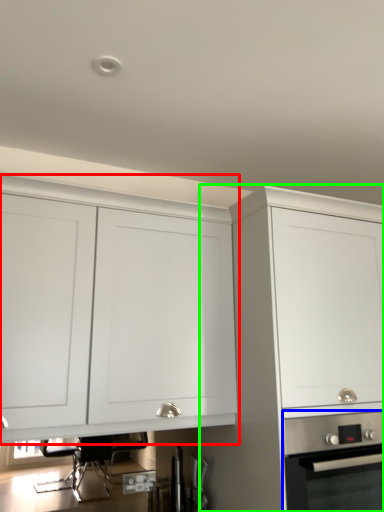
Question: Based on their relative distances, which object is farther from cabinetry (highlighted by a red box)? Choose from home appliance (highlighted by a blue box) and cabinetry (highlighted by a green box).

Choices:
 (A) home appliance
 (B) cabinetry

Answer: (A)